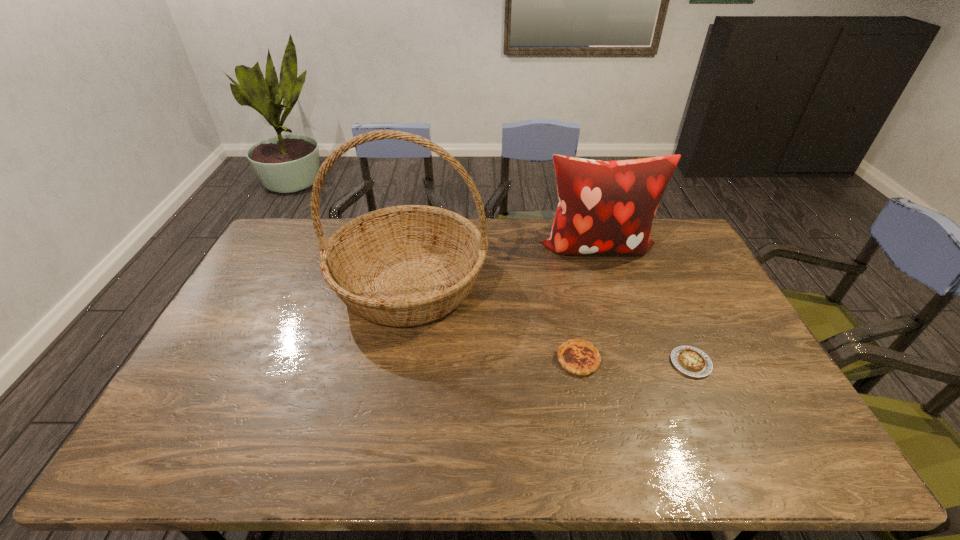
This screenshot has width=960, height=540. What are the coordinates of `vacant space at the near left corner` in the screenshot? It's located at coord(189,443).

At what (x,y) coordinates should I click in order to perform the action: click on empty space between the taller quiche and the shorter quiche. Please return your answer as a coordinate pair (x, y). This screenshot has height=540, width=960. Looking at the image, I should click on (635, 361).

This screenshot has width=960, height=540. What are the coordinates of `free spot between the left quiche and the tallest object` in the screenshot? It's located at (493, 321).

You are a GUI agent. You are given a task and a screenshot of the screen. Output one action in this format:
    pyautogui.click(x=<x>, y=<y>)
    Task: Click on the blank region between the leftmost object and the left quiche
    This screenshot has width=960, height=540.
    Given the screenshot: What is the action you would take?
    pyautogui.click(x=493, y=321)

Where is `empty space that is in between the shorter quiche and the basket`? Image resolution: width=960 pixels, height=540 pixels. empty space that is in between the shorter quiche and the basket is located at coordinates (550, 323).

This screenshot has width=960, height=540. What are the coordinates of `free point between the basket and the third shortest object` in the screenshot? It's located at (502, 265).

Where is `vacant space that is in between the cushion and the basket`? The width and height of the screenshot is (960, 540). vacant space that is in between the cushion and the basket is located at coordinates (502, 265).

Locate an element on the screen. The image size is (960, 540). blank region between the left quiche and the leftmost object is located at coordinates (493, 321).

You are a GUI agent. You are given a task and a screenshot of the screen. Output one action in this format:
    pyautogui.click(x=<x>, y=<y>)
    Task: Click on the free space that is in between the cushion and the tallest object
    This screenshot has height=540, width=960.
    Given the screenshot: What is the action you would take?
    (x=502, y=265)

You are a GUI agent. You are given a task and a screenshot of the screen. Output one action in this format:
    pyautogui.click(x=<x>, y=<y>)
    Task: Click on the vacant area that lies between the taller quiche and the leftmost object
    Image resolution: width=960 pixels, height=540 pixels.
    Given the screenshot: What is the action you would take?
    pyautogui.click(x=493, y=321)